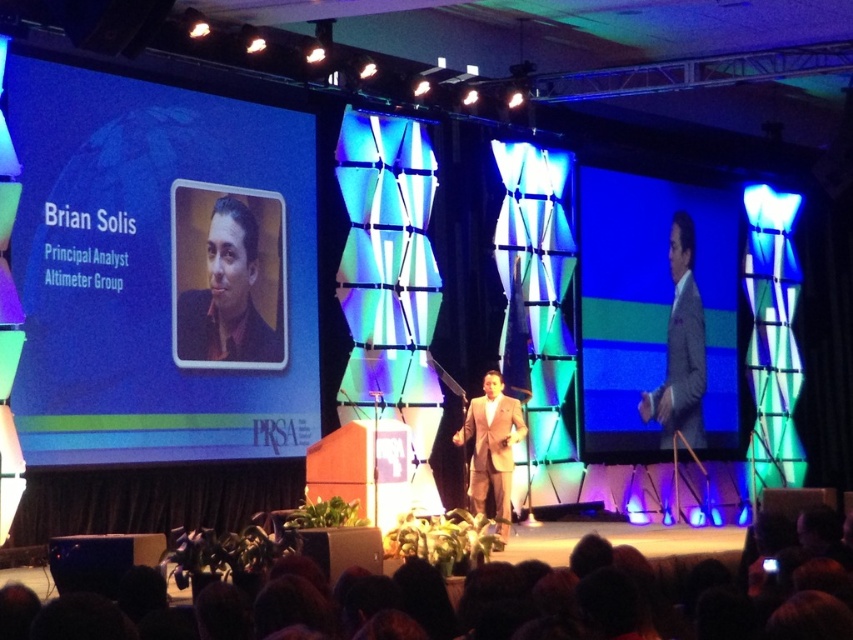
You are an event planner organizing a photoshoot on the stage. You need to place a large backdrop that will cover the area between the matte gray suit at right and the matte gray suit at center. Based on their positions, which side of the backdrop should be closer to the left edge of the stage?

The matte gray suit at right is positioned on the left side of matte gray suit at center, so the left side of the backdrop should be closer to the left edge of the stage to cover the area between them.

You are an event coordinator trying to position a microphone stand for Brian Solis during his presentation. The stage has a large screen on the left and you need to place the stand near the matte gray suit at right. According to the stage setup, where should you position the microphone stand relative to the screen?

The matte gray suit at right is located at point (x=657, y=314), so the microphone stand should be positioned near that coordinate to the right of the large screen on the left.